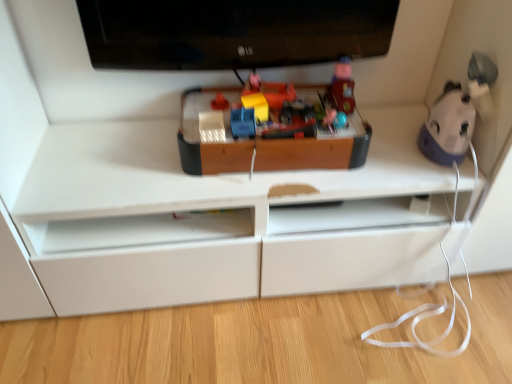
The width and height of the screenshot is (512, 384). I want to click on free location above wooden toy at center, the 3th toy positioned from the right (from a real-world perspective), so click(275, 117).